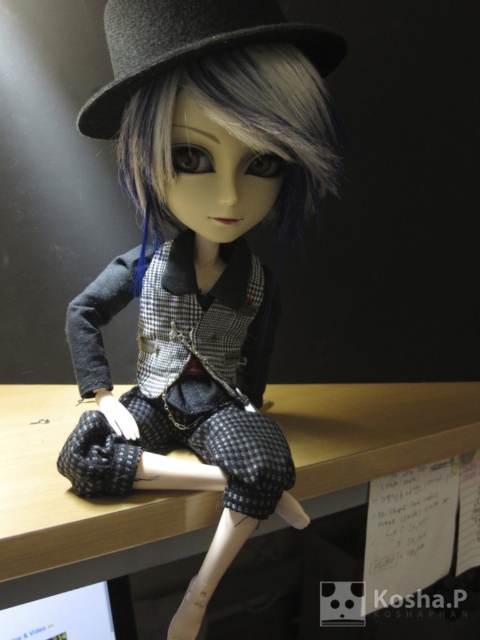
You are an interior designer working on a project and need to place a 2D sticker exactly where the matte black doll at center is located. What are the coordinates you should use?

The coordinates for the matte black doll at center are at point (201, 250), so you should place the sticker at those coordinates.

You are a photographer setting up a shot of the doll. You want to ensure the gray matte hair at center is visible in front of the wooden table at center. Is this possible based on their current positions?

The gray matte hair at center is behind the wooden table at center, so it would not be visible in front of it unless the table is moved or the doll is repositioned.